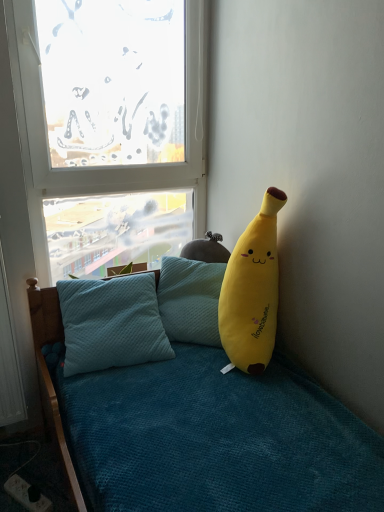
Question: Is yellow plush at right not close to black plastic power outlet at lower left?

Choices:
 (A) yes
 (B) no

Answer: (A)

Question: Is yellow plush at right closer to the viewer compared to black plastic power outlet at lower left?

Choices:
 (A) yes
 (B) no

Answer: (A)

Question: Is black plastic power outlet at lower left located within yellow plush at right?

Choices:
 (A) no
 (B) yes

Answer: (A)

Question: Is yellow plush at right facing away from black plastic power outlet at lower left?

Choices:
 (A) no
 (B) yes

Answer: (A)

Question: Considering the relative sizes of yellow plush at right and black plastic power outlet at lower left in the image provided, is yellow plush at right bigger than black plastic power outlet at lower left?

Choices:
 (A) yes
 (B) no

Answer: (A)

Question: Is yellow plush at right not inside black plastic power outlet at lower left?

Choices:
 (A) yes
 (B) no

Answer: (A)

Question: From the image's perspective, is transparent glass window at upper left under yellow plush at right?

Choices:
 (A) yes
 (B) no

Answer: (B)

Question: Is transparent glass window at upper left positioned beyond the bounds of yellow plush at right?

Choices:
 (A) yes
 (B) no

Answer: (A)

Question: Can you confirm if transparent glass window at upper left is smaller than yellow plush at right?

Choices:
 (A) no
 (B) yes

Answer: (A)

Question: Is transparent glass window at upper left taller than yellow plush at right?

Choices:
 (A) yes
 (B) no

Answer: (A)

Question: From a real-world perspective, does transparent glass window at upper left stand above yellow plush at right?

Choices:
 (A) yes
 (B) no

Answer: (A)

Question: Is transparent glass window at upper left facing away from yellow plush at right?

Choices:
 (A) yes
 (B) no

Answer: (B)

Question: Considering the relative positions of black plastic power outlet at lower left and yellow plush at right in the image provided, is black plastic power outlet at lower left to the right of yellow plush at right from the viewer's perspective?

Choices:
 (A) yes
 (B) no

Answer: (B)